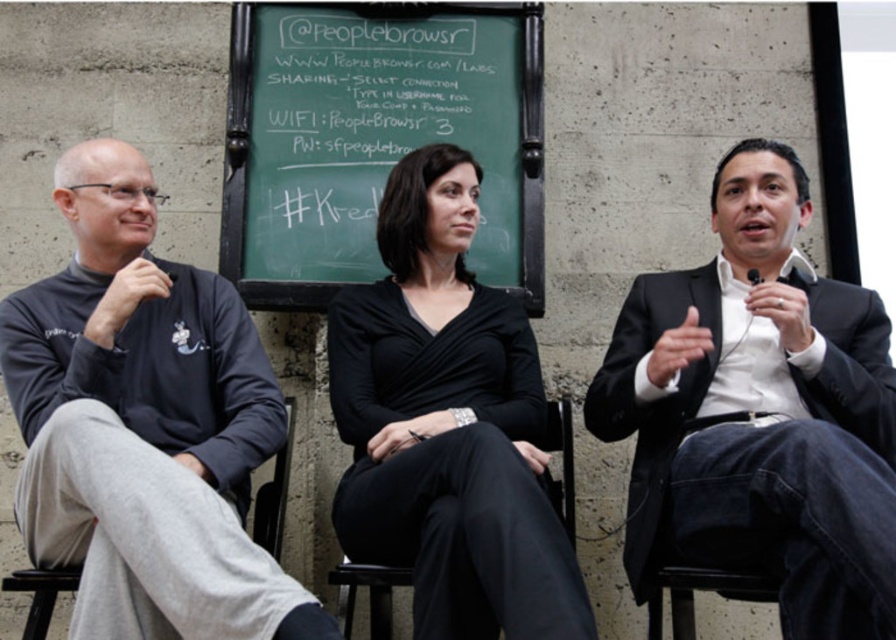
You are organizing a small event and need to arrange seating. You have a black suit at center and a gray fabric chair at left. Based on the scene, which object is positioned lower in the image?

The black suit at center is located below the gray fabric chair at left, so the black suit at center is positioned lower in the image.

You are organizing a small event and need to arrange the seating so that the black suit at center is to the right of the gray fabric chair at left. Based on the current arrangement shown in the image, is this requirement already met?

Yes, the requirement is already met because the black suit at center is to the right of the gray fabric chair at left as described in the scene.